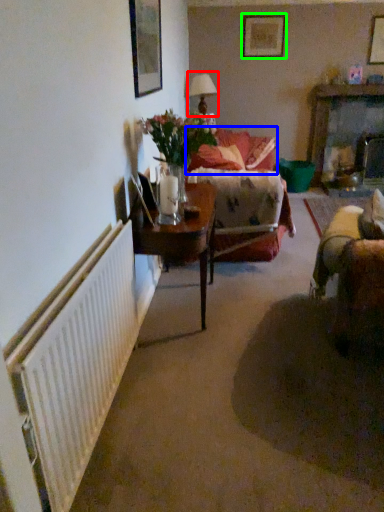
Question: Considering the real-world distances, which object is farthest from table lamp (highlighted by a red box)? couch (highlighted by a blue box) or picture frame (highlighted by a green box)?

Choices:
 (A) couch
 (B) picture frame

Answer: (A)